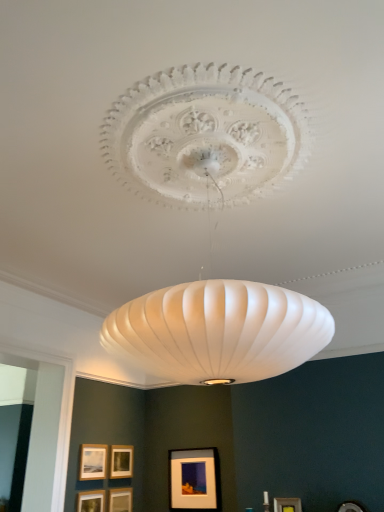
Question: From the image's perspective, is matte gold picture frame at lower center, the 1th picture frame when ordered from right to left, above or below matte gold picture frame at lower left, which appears as the sixth picture frame when viewed from the right?

Choices:
 (A) below
 (B) above

Answer: (A)

Question: Which is correct: matte gold picture frame at lower center, marked as the sixth picture frame in a left-to-right arrangement, is inside matte gold picture frame at lower left, which appears as the sixth picture frame when viewed from the right, or outside of it?

Choices:
 (A) inside
 (B) outside

Answer: (B)

Question: Which object is the closest to the matte gold picture frame at lower left, which is the first picture frame from left to right?

Choices:
 (A) wooden picture frame at lower center, which ranks as the fourth picture frame in left-to-right order
 (B) matte gold picture frame at lower center, which is the fifth picture frame from right to left
 (C) matte black picture frame at lower center, marked as the fifth picture frame in a left-to-right arrangement
 (D) matte gold picture frame at lower center, marked as the sixth picture frame in a left-to-right arrangement
 (E) matte gold picture frame at center, acting as the 4th picture frame starting from the right

Answer: (E)

Question: Which object is the closest to the matte gold picture frame at lower center, marked as the sixth picture frame in a left-to-right arrangement?

Choices:
 (A) matte gold picture frame at lower left, which appears as the sixth picture frame when viewed from the right
 (B) wooden picture frame at lower center, the 3th picture frame positioned from the right
 (C) matte black picture frame at lower center, marked as the 2th picture frame in a right-to-left arrangement
 (D) matte gold picture frame at lower center, which is counted as the second picture frame, starting from the left
 (E) matte gold picture frame at center, which ranks as the 3th picture frame in left-to-right order

Answer: (C)